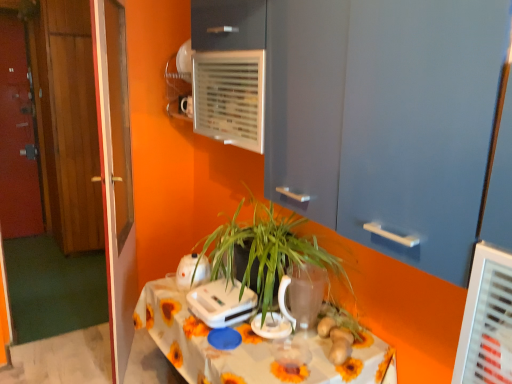
What are the coordinates of `empty space that is ontop of white plastic appliance at center, the second appliance from the left` in the screenshot? It's located at (228, 291).